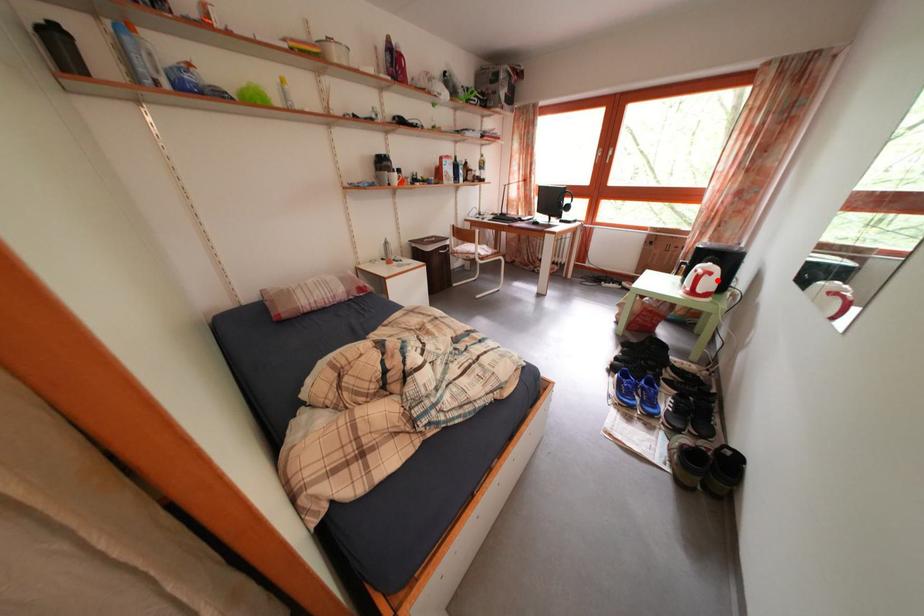
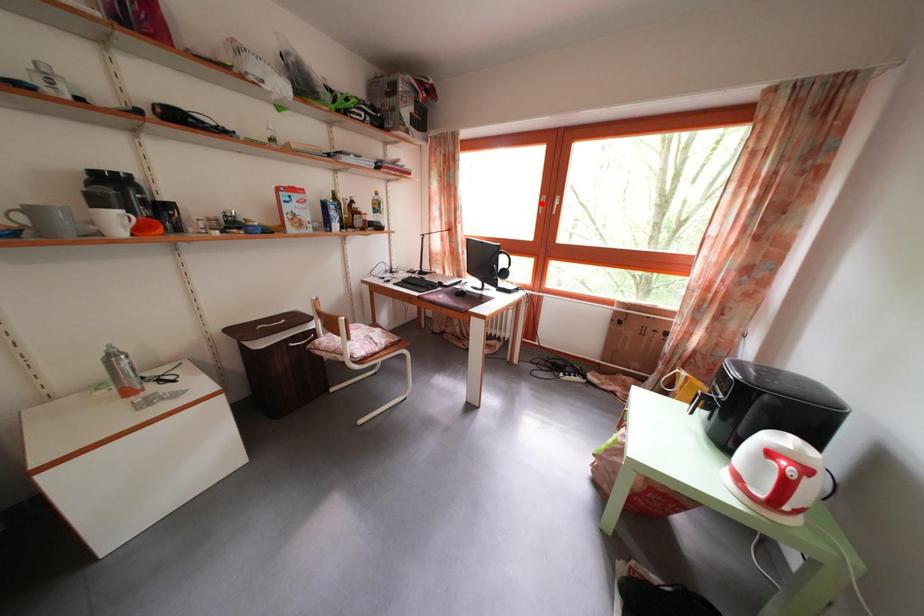
I am providing you with two images of the same scene from different viewpoints. A red point is marked on the first image and another point is marked on the second image. Is the red point in image1 aligned with the point shown in image2?

No